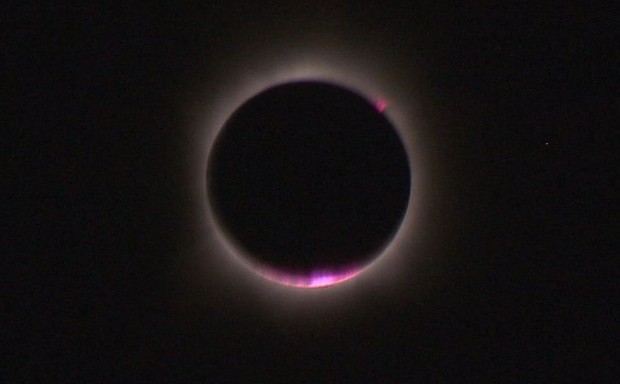
Locate an element on the screen. The height and width of the screenshot is (384, 620). purple light is located at coordinates (325, 280).